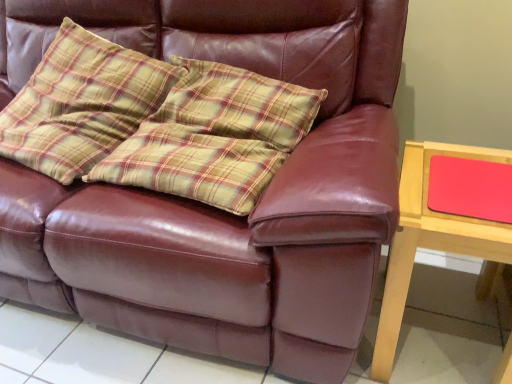
Question: Can you confirm if plaid fabric pillow at upper left is wider than matte red mousepad at right?

Choices:
 (A) no
 (B) yes

Answer: (B)

Question: From the image's perspective, is plaid fabric pillow at upper left located above matte red mousepad at right?

Choices:
 (A) yes
 (B) no

Answer: (A)

Question: Could you tell me if plaid fabric pillow at upper left is turned towards matte red mousepad at right?

Choices:
 (A) yes
 (B) no

Answer: (B)

Question: Is the position of plaid fabric pillow at upper left less distant than that of matte red mousepad at right?

Choices:
 (A) yes
 (B) no

Answer: (B)

Question: Is plaid fabric pillow at upper left bigger than matte red mousepad at right?

Choices:
 (A) yes
 (B) no

Answer: (A)

Question: Considering the positions of plaid fabric pillow at upper left and matte red mousepad at right in the image, is plaid fabric pillow at upper left wider or thinner than matte red mousepad at right?

Choices:
 (A) thin
 (B) wide

Answer: (B)

Question: From a real-world perspective, is plaid fabric pillow at upper left positioned above or below matte red mousepad at right?

Choices:
 (A) below
 (B) above

Answer: (B)

Question: Considering the positions of plaid fabric pillow at upper left and matte red mousepad at right in the image, is plaid fabric pillow at upper left taller or shorter than matte red mousepad at right?

Choices:
 (A) short
 (B) tall

Answer: (B)

Question: Would you say plaid fabric pillow at upper left is inside or outside matte red mousepad at right?

Choices:
 (A) inside
 (B) outside

Answer: (B)

Question: From a real-world perspective, relative to matte red mousepad at right, is wooden table at right vertically above or below?

Choices:
 (A) below
 (B) above

Answer: (A)

Question: Looking at the image, does wooden table at right seem bigger or smaller compared to matte red mousepad at right?

Choices:
 (A) big
 (B) small

Answer: (A)

Question: Relative to matte red mousepad at right, is wooden table at right in front or behind?

Choices:
 (A) front
 (B) behind

Answer: (A)

Question: From the image's perspective, is wooden table at right positioned above or below matte red mousepad at right?

Choices:
 (A) above
 (B) below

Answer: (B)

Question: Do you think plaid fabric pillow at upper left is within wooden table at right, or outside of it?

Choices:
 (A) inside
 (B) outside

Answer: (B)

Question: Is plaid fabric pillow at upper left taller or shorter than wooden table at right?

Choices:
 (A) short
 (B) tall

Answer: (B)